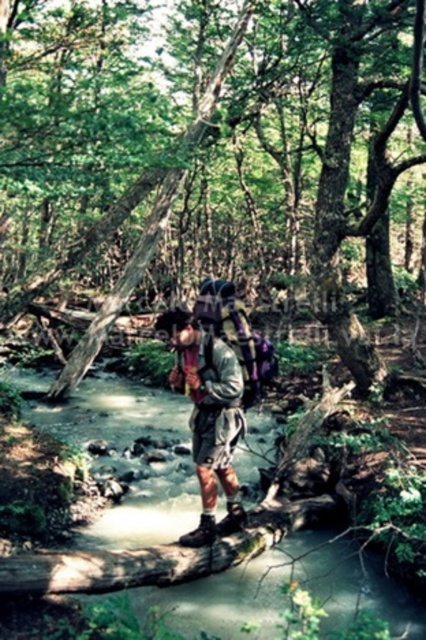
You are a hiker trying to cross the stream using the fallen tree trunk. You see the clear water at stream center and the camouflage fabric backpack at center. Which object is wider? Please answer based on their widths.

The clear water at stream center is wider than camouflage fabric backpack at center according to the description.

You are navigating through the forest and need to cross the stream. You see the rough bark tree at center. Can you use it to cross the stream?

The rough bark tree at center is located at point (271, 163), so yes, you can use it to cross the stream as it spans across the stream.